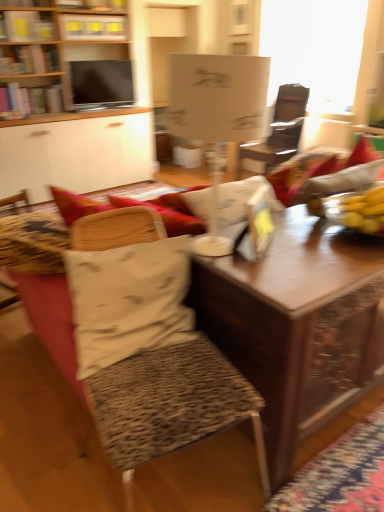
Question: Do you think wooden table at center is within wooden bookshelf at upper center, or outside of it?

Choices:
 (A) outside
 (B) inside

Answer: (A)

Question: Looking at their shapes, would you say wooden table at center is wider or thinner than wooden bookshelf at upper center?

Choices:
 (A) wide
 (B) thin

Answer: (A)

Question: Which object is the farthest from the matte black tv at upper left?

Choices:
 (A) white paper at upper left
 (B) wooden table at center
 (C) wooden bookshelf at upper left
 (D) transparent glass window screen at upper right
 (E) white fabric pillow at center

Answer: (B)

Question: Which object is positioned closest to the wooden desk at center?

Choices:
 (A) transparent glass window screen at upper right
 (B) wooden bookshelf at upper center
 (C) wooden bookshelf at upper left
 (D) white fabric pillow at center
 (E) matte black tv at upper left

Answer: (E)